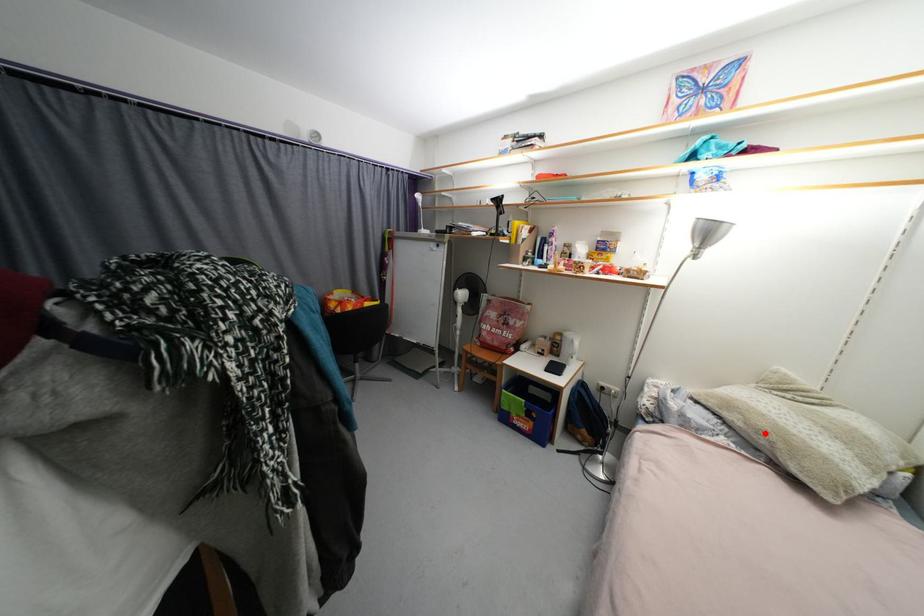
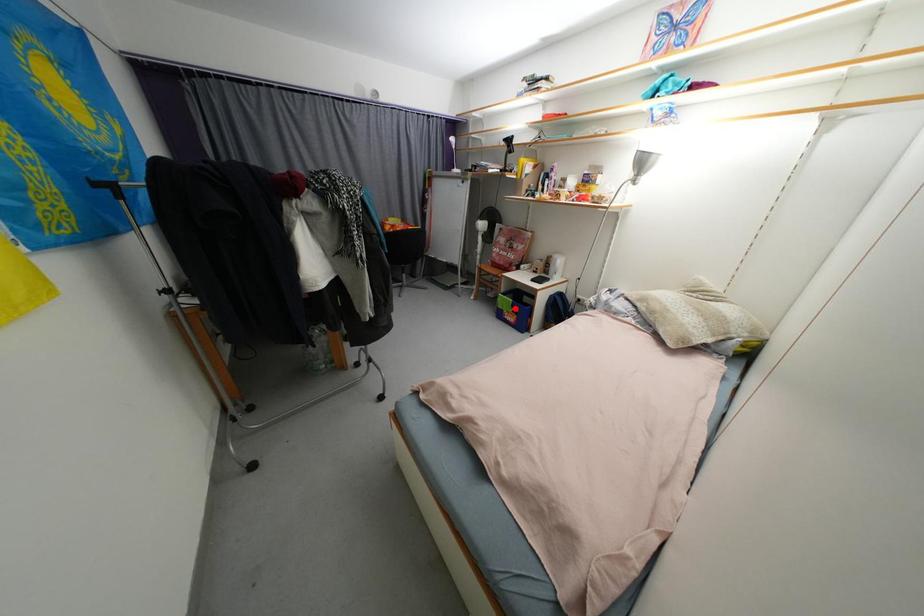
I am providing you with two images of the same scene from different viewpoints. A red point is marked on the first image and another point is marked on the second image. Does the point marked in image1 correspond to the same location as the one in image2?

No